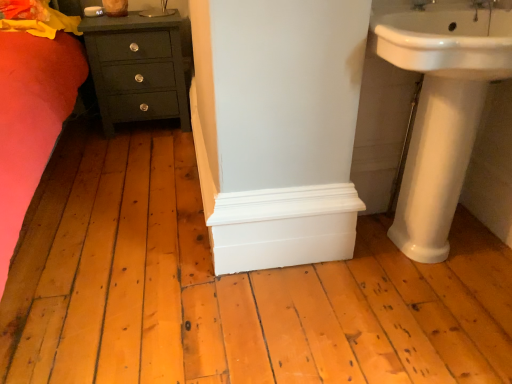
Question: From the image's perspective, is matte dark green chest of drawers at lower left positioned above or below white glossy pedestal sink at right, which ranks as the first sink in bottom-to-top order?

Choices:
 (A) above
 (B) below

Answer: (A)

Question: Based on their positions, is matte dark green chest of drawers at lower left located to the left or right of white glossy pedestal sink at right, which is the second sink in top-to-bottom order?

Choices:
 (A) left
 (B) right

Answer: (A)

Question: Based on their relative distances, which object is farther from the white glossy sink at upper right, which ranks as the 2th sink in bottom-to-top order?

Choices:
 (A) white glossy pedestal sink at right, which ranks as the first sink in bottom-to-top order
 (B) white ceramic tap at upper right
 (C) matte dark green chest of drawers at lower left

Answer: (C)

Question: Estimate the real-world distances between objects in this image. Which object is closer to the white ceramic tap at upper right?

Choices:
 (A) white glossy sink at upper right, which ranks as the 2th sink in bottom-to-top order
 (B) white glossy pedestal sink at right, which ranks as the first sink in bottom-to-top order
 (C) matte dark green chest of drawers at lower left

Answer: (A)